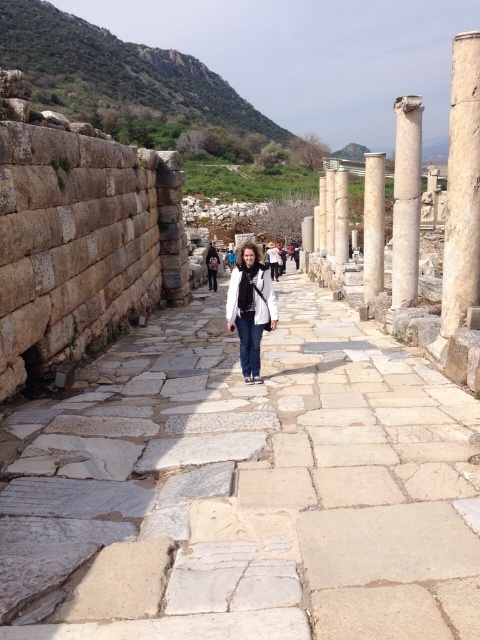
How distant is white marble column at right from white marble column at center?

The distance of white marble column at right from white marble column at center is 31.42 meters.

Who is lower down, white marble column at right or white marble column at center?

white marble column at right

Between point (468, 54) and point (371, 278), which one is positioned behind?

The point (371, 278) is more distant.

Locate an element on the screen. This screenshot has height=640, width=480. white marble column at right is located at coordinates (462, 186).

Is the position of white marble column at right less distant than that of white matte jacket at center?

Yes, white marble column at right is in front of white matte jacket at center.

Does point (465, 209) come closer to viewer compared to point (263, 291)?

Yes.

This screenshot has width=480, height=640. Find the location of `white marble column at right`. white marble column at right is located at coordinates (462, 186).

Find the location of a particular element. white marble column at right is located at coordinates (462, 186).

Is point (463, 106) positioned in front of point (419, 100)?

That is True.

Between point (445, 316) and point (407, 113), which one is positioned in front?

Point (445, 316) is in front.

Where is `white marble column at right`? The height and width of the screenshot is (640, 480). white marble column at right is located at coordinates (462, 186).